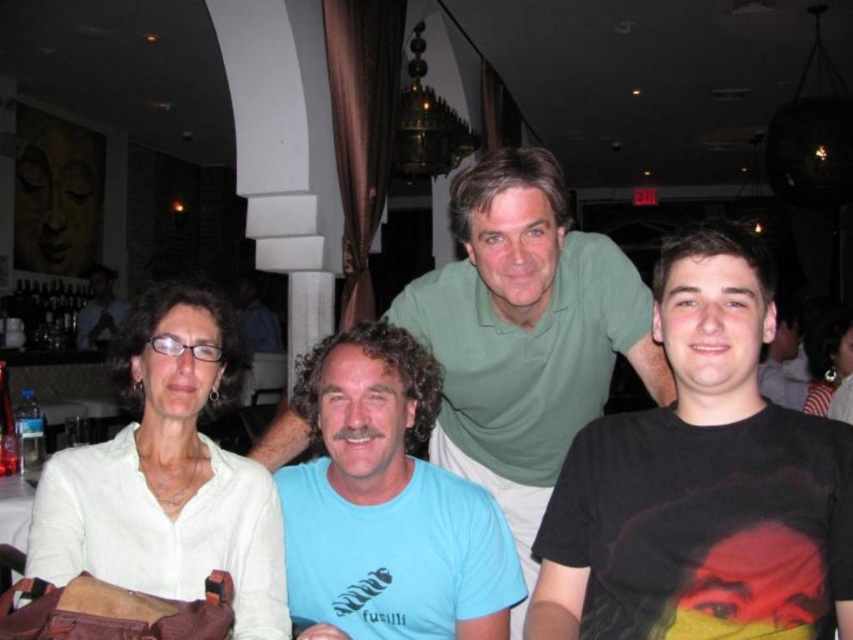
Question: Is black matte t-shirt at right wider than black matte t-shirt at upper right?

Choices:
 (A) no
 (B) yes

Answer: (A)

Question: Which is farther from the black matte t-shirt at upper right?

Choices:
 (A) blue cotton t-shirt at center
 (B) green cotton shirt at upper center
 (C) black matte t-shirt at right

Answer: (C)

Question: Which of the following is the farthest from the observer?

Choices:
 (A) black matte t-shirt at right
 (B) blue cotton t-shirt at center

Answer: (B)

Question: Is black matte t-shirt at right to the left of green cotton shirt at upper center from the viewer's perspective?

Choices:
 (A) no
 (B) yes

Answer: (A)

Question: Is blue cotton t-shirt at center positioned in front of black matte t-shirt at upper right?

Choices:
 (A) yes
 (B) no

Answer: (A)

Question: Which object is closer to the camera taking this photo?

Choices:
 (A) green cotton shirt at upper center
 (B) black matte t-shirt at right

Answer: (B)